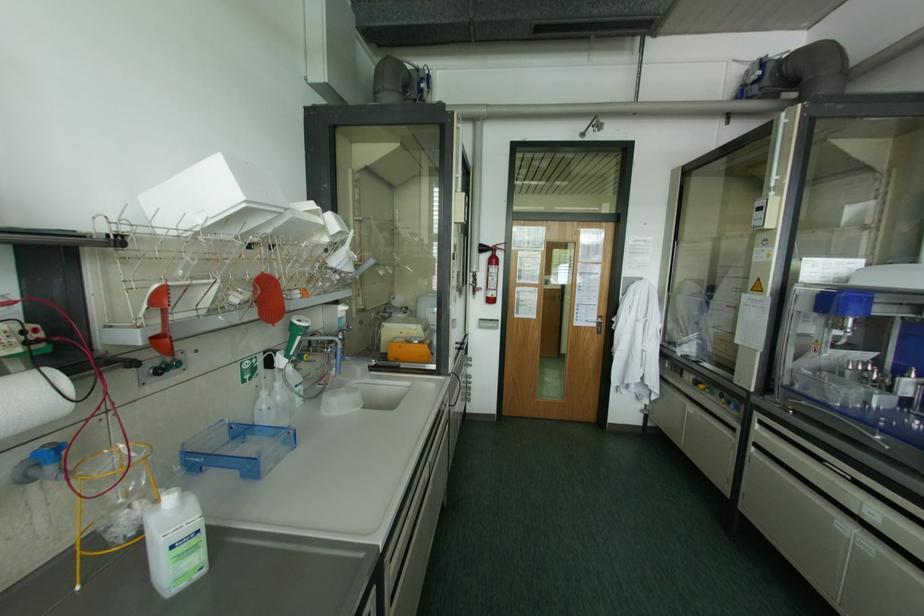
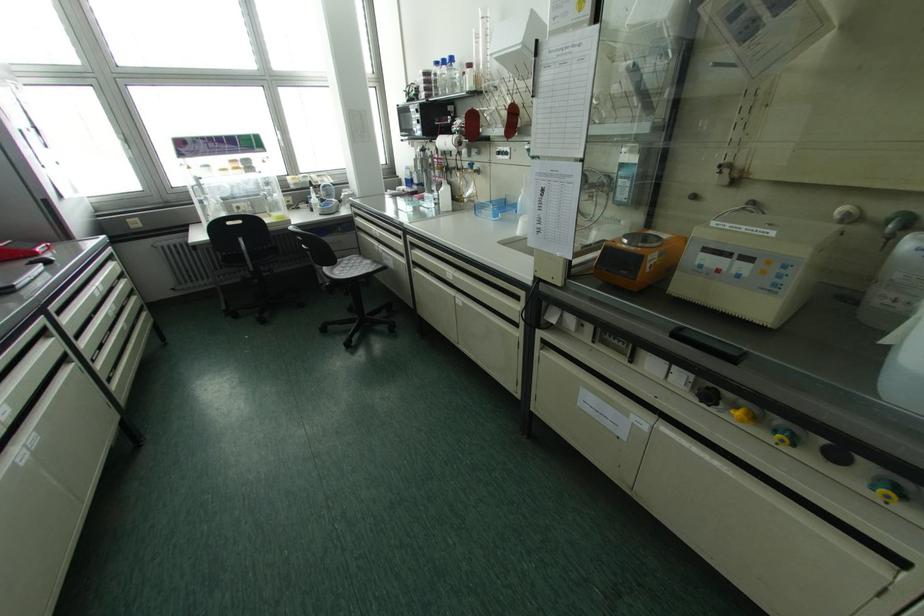
In the second image, find the point that corresponds to (x=159, y=370) in the first image.

(497, 153)